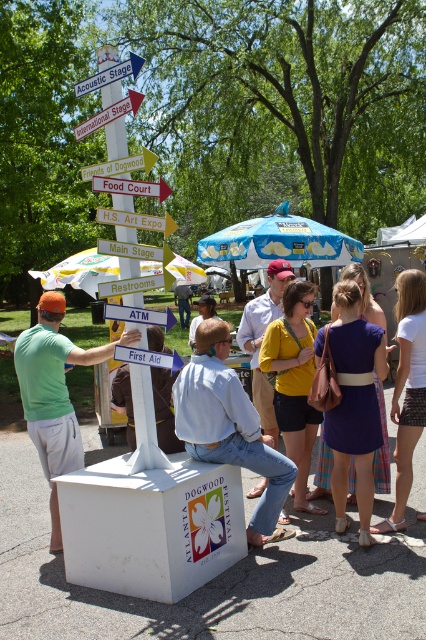
Who is shorter, green matte shirt at left or blue printed fabric umbrella at center?

blue printed fabric umbrella at center is shorter.

Who is lower down, green matte shirt at left or blue printed fabric umbrella at center?

green matte shirt at left is lower down.

Describe the element at coordinates (54, 394) in the screenshot. I see `green matte shirt at left` at that location.

The height and width of the screenshot is (640, 426). In order to click on green matte shirt at left in this screenshot , I will do `click(54, 394)`.

Who is more distant from viewer, (123,365) or (132,61)?

The point (123,365) is more distant.

In the scene shown: Is light blue denim shirt at center positioned behind wooden signpost at upper center?

Yes, light blue denim shirt at center is behind wooden signpost at upper center.

Is point (166, 416) in front of point (85, 83)?

No, it is behind (85, 83).

You are a GUI agent. You are given a task and a screenshot of the screen. Output one action in this format:
    pyautogui.click(x=<x>, y=<y>)
    Task: Click on the light blue denim shirt at center
    Image resolution: width=426 pixels, height=640 pixels.
    Given the screenshot: What is the action you would take?
    pyautogui.click(x=164, y=410)

Is white plastic directional sign at upper center bigger than wooden signpost at upper center?

Yes.

Between white plastic directional sign at upper center and wooden signpost at upper center, which one appears on the left side from the viewer's perspective?

From the viewer's perspective, white plastic directional sign at upper center appears more on the left side.

Identify the location of white plastic directional sign at upper center. The width and height of the screenshot is (426, 640). (109, 113).